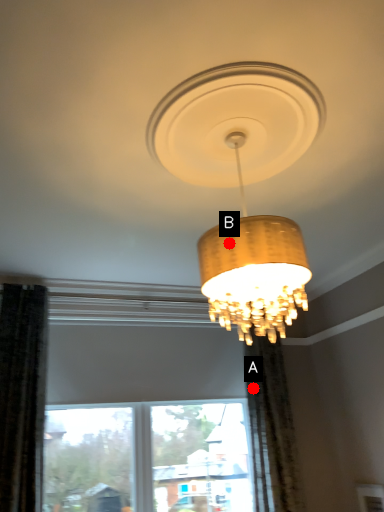
Question: Two points are circled on the image, labeled by A and B beside each circle. Which point is farther from the camera taking this photo?

Choices:
 (A) A is further
 (B) B is further

Answer: (A)